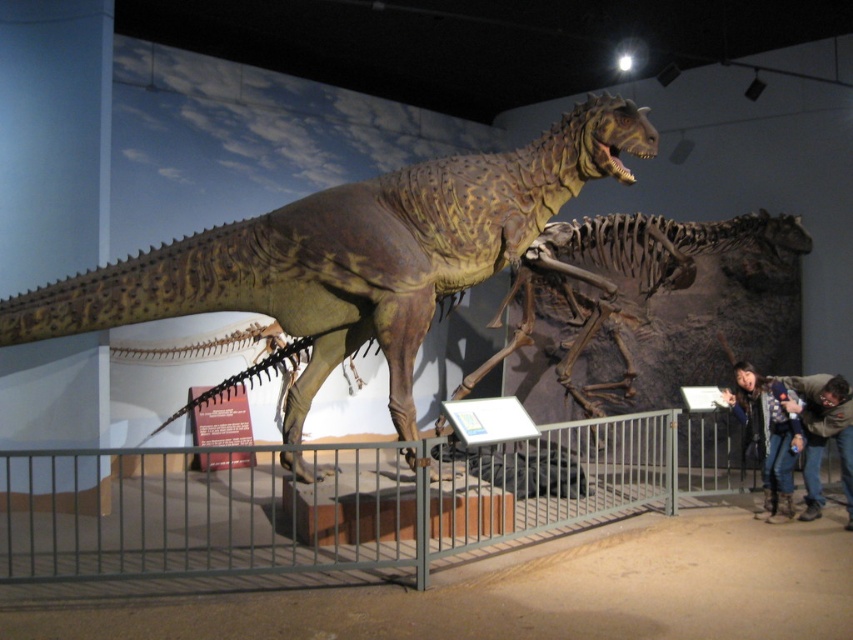
Consider the image. Does brown textured skeleton at center have a lesser height compared to dark gray jeans at lower right?

Incorrect, brown textured skeleton at center's height does not fall short of dark gray jeans at lower right's.

Is brown textured skeleton at center to the left of dark gray jeans at lower right from the viewer's perspective?

Correct, you'll find brown textured skeleton at center to the left of dark gray jeans at lower right.

Locate an element on the screen. brown textured skeleton at center is located at coordinates click(647, 308).

Based on the photo, is shiny brown dinosaur at center above brown textured skeleton at center?

No.

At what (x,y) coordinates should I click in order to perform the action: click on shiny brown dinosaur at center. Please return your answer as a coordinate pair (x, y). Looking at the image, I should click on (354, 253).

The height and width of the screenshot is (640, 853). I want to click on shiny brown dinosaur at center, so click(x=354, y=253).

Does shiny brown dinosaur at center have a larger size compared to dark gray jeans at lower right?

Correct, shiny brown dinosaur at center is larger in size than dark gray jeans at lower right.

Can you confirm if shiny brown dinosaur at center is thinner than dark gray jeans at lower right?

No.

Identify the location of shiny brown dinosaur at center. (354, 253).